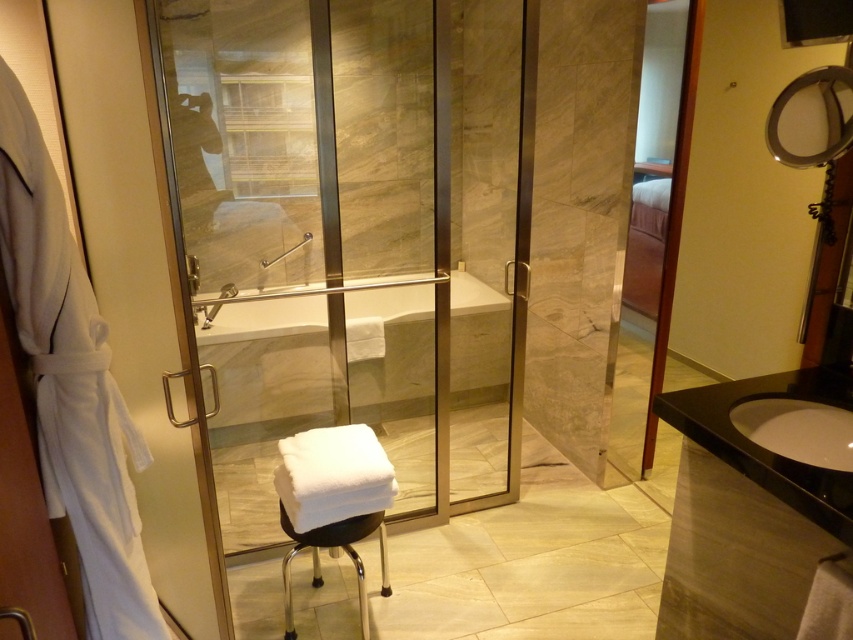
You are standing in the bathroom and want to wash your hands. You see the transparent glass door at center and the white glossy sink at right. Which object should you approach first to reach the sink?

The transparent glass door at center is to the left of the white glossy sink at right, so you should approach the transparent glass door at center first to access the sink.

You are a delivery person carrying a package that is 1.9 meters long. You need to navigate through the bathroom to place the package on the sink. Can you pass between the transparent glass door at center and the white glossy sink at right without tilting the package?

The distance between the transparent glass door at center and the white glossy sink at right is 1.82 meters, which is shorter than the package length of 1.9 meters. Therefore, the package cannot pass through the space between them without tilting.